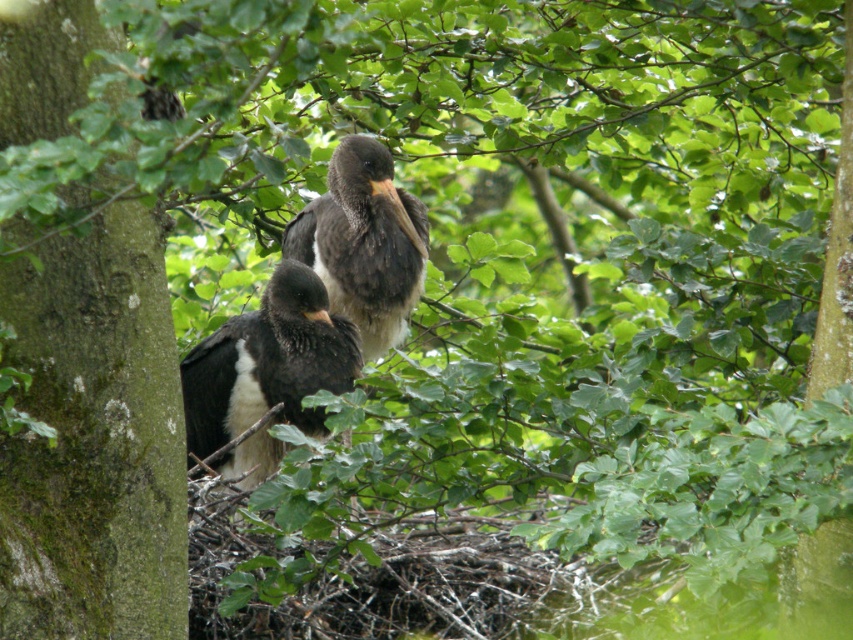
You are a birdwatcher observing two birds in a tree. You notice the dark brown feathers at center and the dark gray feathers at center. Which of these birds is shorter in height?

The dark brown feathers at center has a lesser height compared to dark gray feathers at center, so the bird with dark brown feathers at center is shorter.

You are observing two points in the image of the birds in the tree. Which point, point [345,333] or point [376,333], is positioned closer to you?

Point [345,333] is closer to the viewer than point [376,333].

You are a birdwatcher observing two birds in a tree. You notice dark brown feathers at center and dark gray feathers at center. Which of these two feathers is positioned more to the left?

The dark brown feathers at center are more to the left than the dark gray feathers at center.